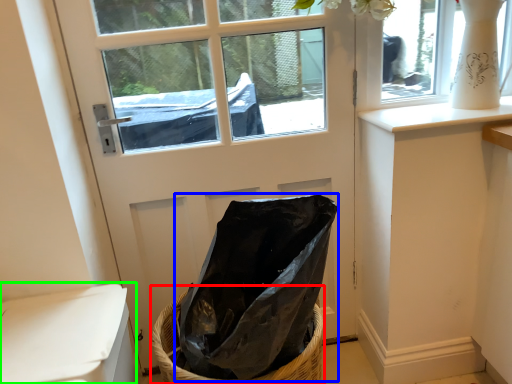
Question: Based on their relative distances, which object is nearer to basket (highlighted by a red box)? Choose from bag (highlighted by a blue box) and armchair (highlighted by a green box).

Choices:
 (A) bag
 (B) armchair

Answer: (A)